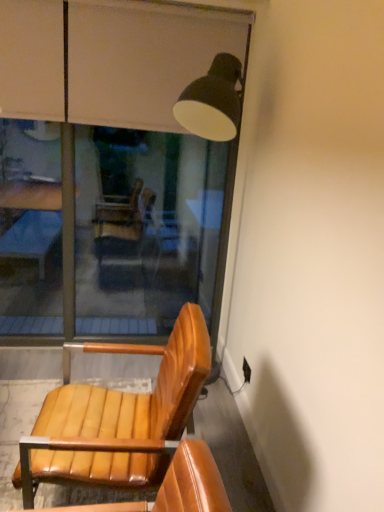
Question: Is transparent glass window at upper center to the right of leather wood chair at lower left from the viewer's perspective?

Choices:
 (A) yes
 (B) no

Answer: (B)

Question: From the image's perspective, does transparent glass window at upper center appear lower than leather wood chair at lower left?

Choices:
 (A) no
 (B) yes

Answer: (A)

Question: Considering the relative sizes of transparent glass window at upper center and leather wood chair at lower left in the image provided, is transparent glass window at upper center bigger than leather wood chair at lower left?

Choices:
 (A) yes
 (B) no

Answer: (A)

Question: Does transparent glass window at upper center have a greater height compared to leather wood chair at lower left?

Choices:
 (A) no
 (B) yes

Answer: (B)

Question: Can you confirm if transparent glass window at upper center is shorter than leather wood chair at lower left?

Choices:
 (A) no
 (B) yes

Answer: (A)

Question: Does transparent glass window at upper center have a smaller size compared to leather wood chair at lower left?

Choices:
 (A) no
 (B) yes

Answer: (A)

Question: Is leather wood chair at lower left not within transparent glass window at upper center?

Choices:
 (A) yes
 (B) no

Answer: (A)

Question: Can you confirm if leather wood chair at lower left is positioned to the right of transparent glass window at upper center?

Choices:
 (A) no
 (B) yes

Answer: (B)

Question: Considering the relative sizes of leather wood chair at lower left and transparent glass window at upper center in the image provided, is leather wood chair at lower left wider than transparent glass window at upper center?

Choices:
 (A) yes
 (B) no

Answer: (A)

Question: Is leather wood chair at lower left at the left side of transparent glass window at upper center?

Choices:
 (A) no
 (B) yes

Answer: (A)

Question: Is transparent glass window at upper center at the back of leather wood chair at lower left?

Choices:
 (A) yes
 (B) no

Answer: (B)

Question: Is leather wood chair at lower left positioned behind transparent glass window at upper center?

Choices:
 (A) yes
 (B) no

Answer: (B)

Question: Based on their sizes in the image, would you say transparent glass window at upper center is bigger or smaller than leather wood chair at lower left?

Choices:
 (A) big
 (B) small

Answer: (A)